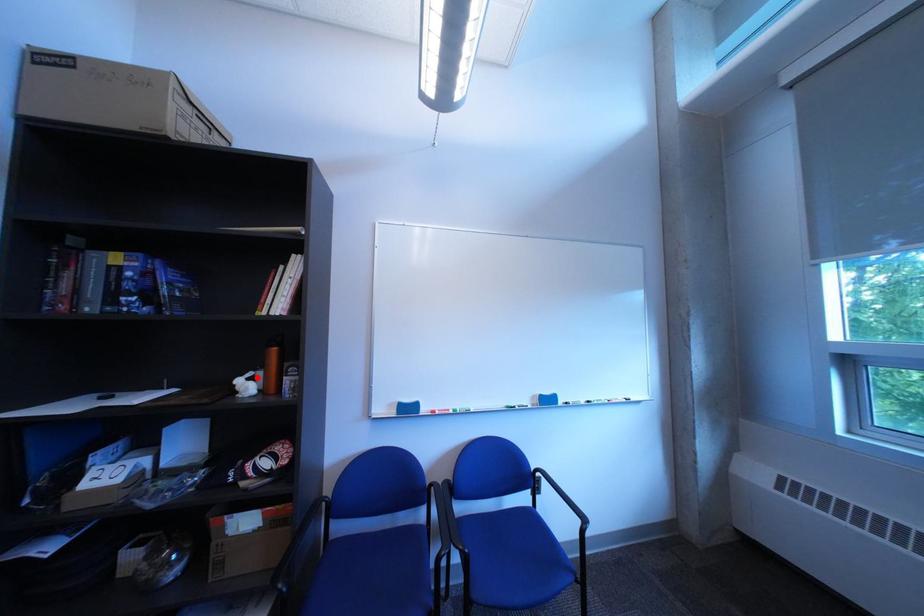
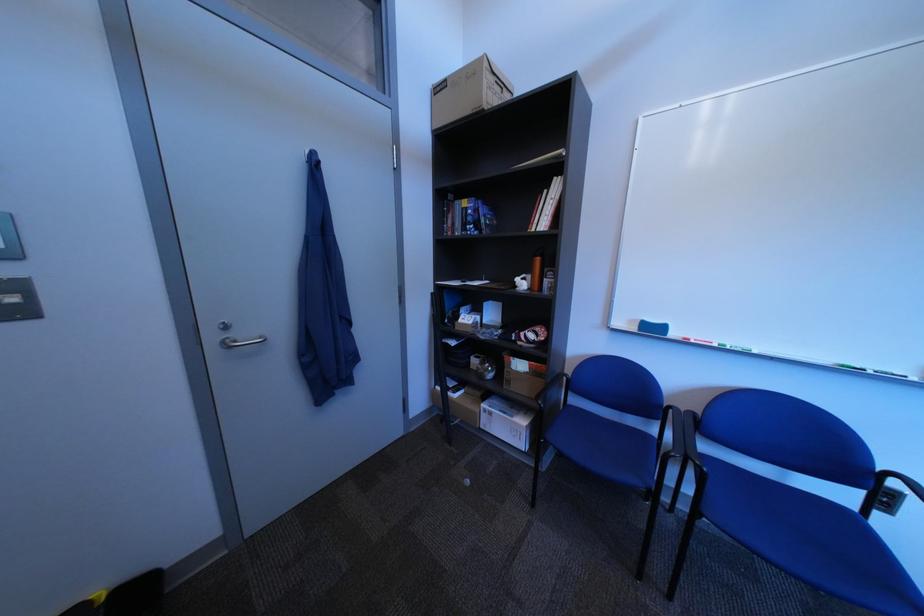
Locate, in the second image, the point that corresponds to the highlighted location in the first image.

(535, 278)